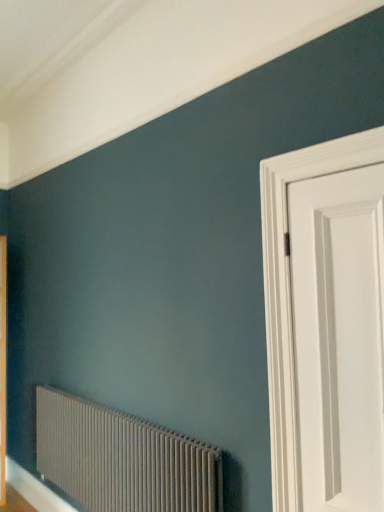
Question: Would you say matte gray radiator at lower left is outside white glossy door at right?

Choices:
 (A) yes
 (B) no

Answer: (A)

Question: From a real-world perspective, is matte gray radiator at lower left located beneath white glossy door at right?

Choices:
 (A) no
 (B) yes

Answer: (B)

Question: Can you confirm if matte gray radiator at lower left is thinner than white glossy door at right?

Choices:
 (A) yes
 (B) no

Answer: (B)

Question: Is white glossy door at right inside matte gray radiator at lower left?

Choices:
 (A) no
 (B) yes

Answer: (A)

Question: Would you consider matte gray radiator at lower left to be distant from white glossy door at right?

Choices:
 (A) no
 (B) yes

Answer: (B)

Question: Does matte gray radiator at lower left lie behind white glossy door at right?

Choices:
 (A) yes
 (B) no

Answer: (A)

Question: Can you confirm if white glossy door at right is thinner than matte gray radiator at lower left?

Choices:
 (A) yes
 (B) no

Answer: (A)

Question: Is white glossy door at right positioned in front of matte gray radiator at lower left?

Choices:
 (A) no
 (B) yes

Answer: (B)

Question: Is white glossy door at right to the right of matte gray radiator at lower left from the viewer's perspective?

Choices:
 (A) yes
 (B) no

Answer: (A)

Question: Does white glossy door at right have a larger size compared to matte gray radiator at lower left?

Choices:
 (A) no
 (B) yes

Answer: (A)

Question: From a real-world perspective, is white glossy door at right positioned over matte gray radiator at lower left based on gravity?

Choices:
 (A) no
 (B) yes

Answer: (B)

Question: Is white glossy door at right oriented away from matte gray radiator at lower left?

Choices:
 (A) yes
 (B) no

Answer: (B)

Question: Is white glossy door at right wider or thinner than matte gray radiator at lower left?

Choices:
 (A) wide
 (B) thin

Answer: (B)